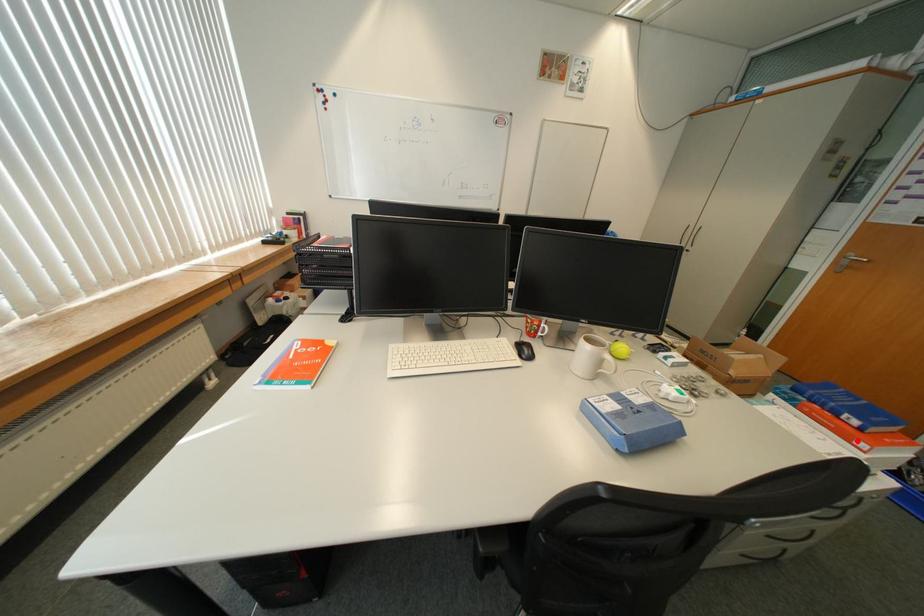
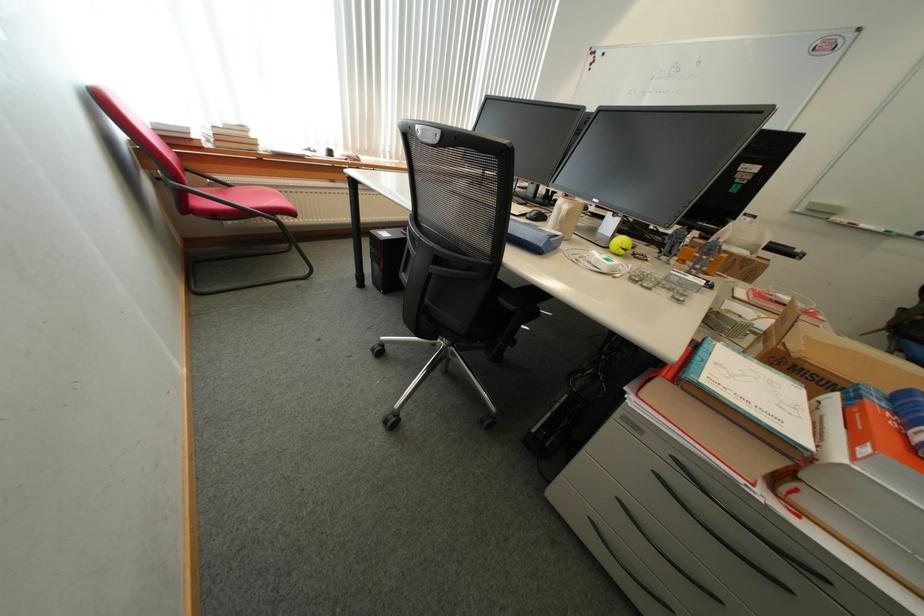
Find the pixel in the second image that matches the highlighted location in the first image.

(864, 446)